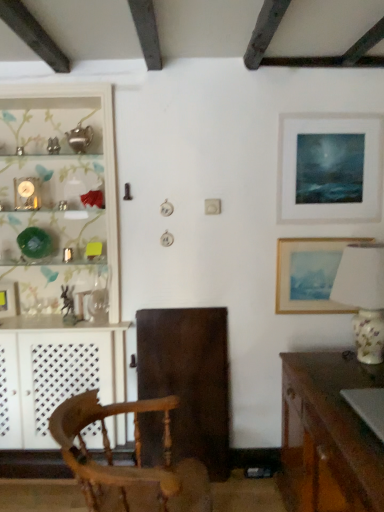
Question: Is matte glass shelf at left aimed at wooden chair at center?

Choices:
 (A) yes
 (B) no

Answer: (A)

Question: Considering the relative sizes of matte glass shelf at left and wooden chair at center in the image provided, is matte glass shelf at left wider than wooden chair at center?

Choices:
 (A) no
 (B) yes

Answer: (A)

Question: From the image's perspective, is matte glass shelf at left above wooden chair at center?

Choices:
 (A) no
 (B) yes

Answer: (B)

Question: Considering the relative sizes of matte glass shelf at left and wooden chair at center in the image provided, is matte glass shelf at left smaller than wooden chair at center?

Choices:
 (A) yes
 (B) no

Answer: (B)

Question: From a real-world perspective, is matte glass shelf at left beneath wooden chair at center?

Choices:
 (A) no
 (B) yes

Answer: (A)

Question: Considering the positions of wooden desk at lower right and wooden chair at center in the image, is wooden desk at lower right bigger or smaller than wooden chair at center?

Choices:
 (A) big
 (B) small

Answer: (A)

Question: In terms of width, does wooden desk at lower right look wider or thinner when compared to wooden chair at center?

Choices:
 (A) wide
 (B) thin

Answer: (B)

Question: From a real-world perspective, relative to wooden chair at center, is wooden desk at lower right vertically above or below?

Choices:
 (A) below
 (B) above

Answer: (A)

Question: From the image's perspective, is wooden desk at lower right above or below wooden chair at center?

Choices:
 (A) above
 (B) below

Answer: (B)

Question: Does point (306, 261) appear closer or farther from the camera than point (284, 359)?

Choices:
 (A) closer
 (B) farther

Answer: (B)

Question: Considering the positions of wooden picture frame at right, acting as the 2th picture frame starting from the top, and wooden desk at lower right in the image, is wooden picture frame at right, acting as the 2th picture frame starting from the top, wider or thinner than wooden desk at lower right?

Choices:
 (A) thin
 (B) wide

Answer: (A)

Question: Would you say wooden picture frame at right, the second picture frame in the left-to-right sequence, is to the left or to the right of wooden desk at lower right in the picture?

Choices:
 (A) right
 (B) left

Answer: (B)

Question: Considering the positions of wooden picture frame at right, positioned as the 2th picture frame in right-to-left order, and wooden desk at lower right in the image, is wooden picture frame at right, positioned as the 2th picture frame in right-to-left order, bigger or smaller than wooden desk at lower right?

Choices:
 (A) small
 (B) big

Answer: (A)

Question: In the image, is wooden picture frame at right, positioned as the 2th picture frame in right-to-left order, on the left side or the right side of porcelain floral lamp at right?

Choices:
 (A) left
 (B) right

Answer: (A)

Question: Is wooden picture frame at right, the second picture frame in the left-to-right sequence, wider or thinner than porcelain floral lamp at right?

Choices:
 (A) wide
 (B) thin

Answer: (B)